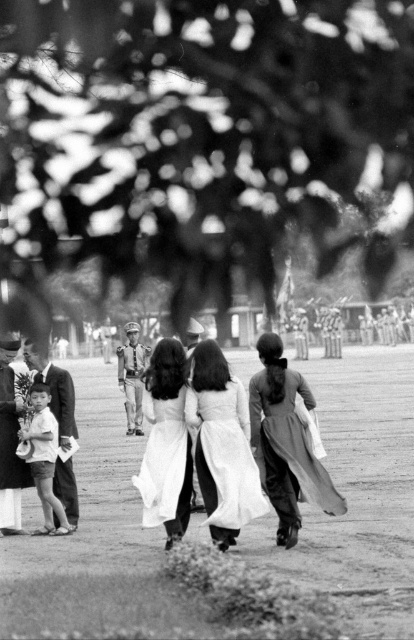
Is point (291, 410) positioned before point (228, 460)?

No.

Who is lower down, silky white dress at center or white satin dress at center?

white satin dress at center is below.

Locate an element on the screen. silky white dress at center is located at coordinates (286, 442).

Is silky white dress at center positioned in front of smooth skin child at left?

Yes, silky white dress at center is closer to the viewer.

Consider the image. Who is more distant from viewer, (272, 406) or (48, 428)?

The point (48, 428) is more distant.

The height and width of the screenshot is (640, 414). I want to click on silky white dress at center, so click(286, 442).

This screenshot has width=414, height=640. What do you see at coordinates (166, 465) in the screenshot?
I see `white silk ao dai at center` at bounding box center [166, 465].

Find the location of a particular element. This screenshot has height=640, width=414. white silk ao dai at center is located at coordinates (166, 465).

This screenshot has height=640, width=414. Identify the location of white silk ao dai at center. (166, 465).